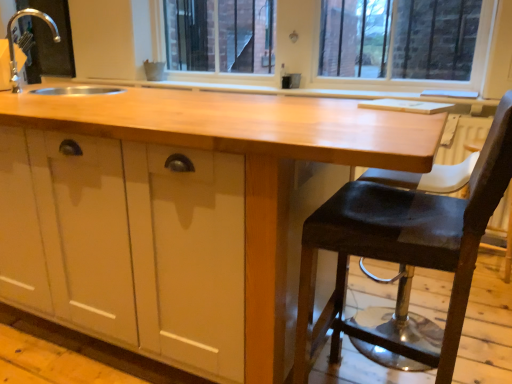
Question: Considering the positions of dark brown leather stool at right and silver metallic faucet at upper left in the image, is dark brown leather stool at right wider or thinner than silver metallic faucet at upper left?

Choices:
 (A) wide
 (B) thin

Answer: (A)

Question: Considering the positions of dark brown leather stool at right and silver metallic faucet at upper left in the image, is dark brown leather stool at right taller or shorter than silver metallic faucet at upper left?

Choices:
 (A) tall
 (B) short

Answer: (A)

Question: Estimate the real-world distances between objects in this image. Which object is farther from the dark brown leather stool at right?

Choices:
 (A) silver metallic faucet at upper left
 (B) glossy wood countertop at center

Answer: (A)

Question: Estimate the real-world distances between objects in this image. Which object is closer to the dark brown leather stool at right?

Choices:
 (A) glossy wood countertop at center
 (B) silver metallic faucet at upper left

Answer: (A)